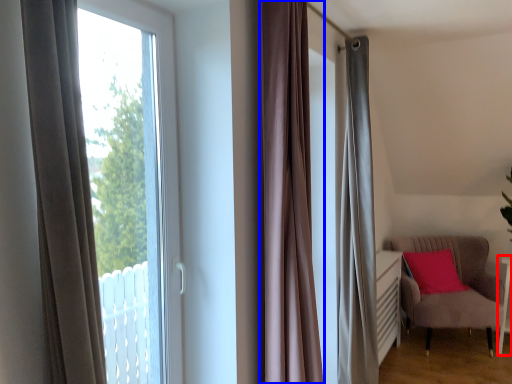
Question: Which object appears closest to the camera in this image, side table (highlighted by a red box) or curtain (highlighted by a blue box)?

Choices:
 (A) side table
 (B) curtain

Answer: (B)